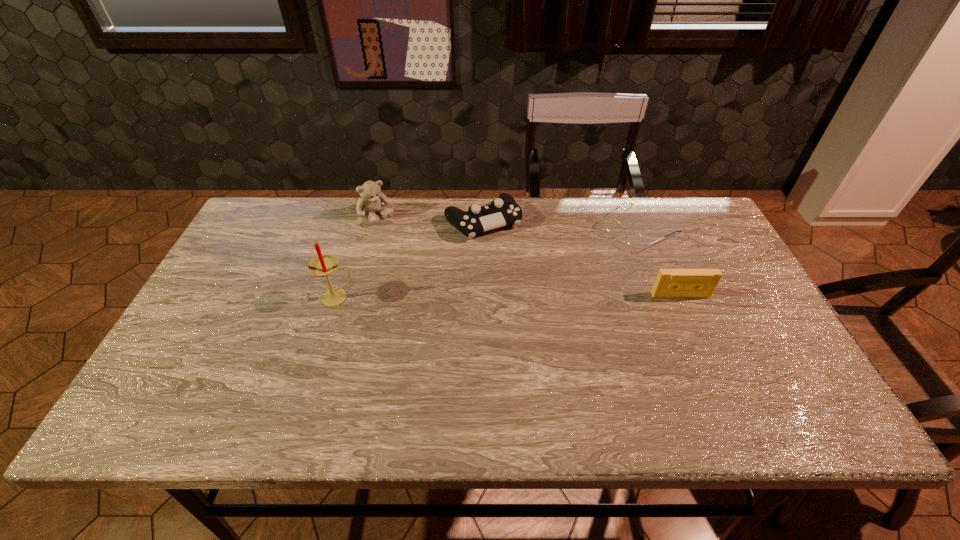
Where is `vacant space in between the teddy bear and the third object from left to right`? The image size is (960, 540). vacant space in between the teddy bear and the third object from left to right is located at coordinates (430, 219).

Where is `empty space that is in between the control and the tallest object`? The width and height of the screenshot is (960, 540). empty space that is in between the control and the tallest object is located at coordinates (410, 260).

Image resolution: width=960 pixels, height=540 pixels. What are the coordinates of `free space between the control and the candle` in the screenshot? It's located at (410, 260).

The width and height of the screenshot is (960, 540). Find the location of `vacant area that lies between the third object from left to right and the tallest object`. vacant area that lies between the third object from left to right and the tallest object is located at coordinates (410, 260).

Locate an element on the screen. The width and height of the screenshot is (960, 540). vacant area that lies between the third object from left to right and the tallest object is located at coordinates (410, 260).

I want to click on unoccupied position between the videotape and the tallest object, so click(x=509, y=296).

I want to click on empty space that is in between the teddy bear and the candle, so click(357, 256).

Find the location of a particular element. The height and width of the screenshot is (540, 960). object that can be found as the second closest to the spectacles is located at coordinates (503, 211).

The width and height of the screenshot is (960, 540). Identify the location of object that is the closest one to the tallest object. (371, 198).